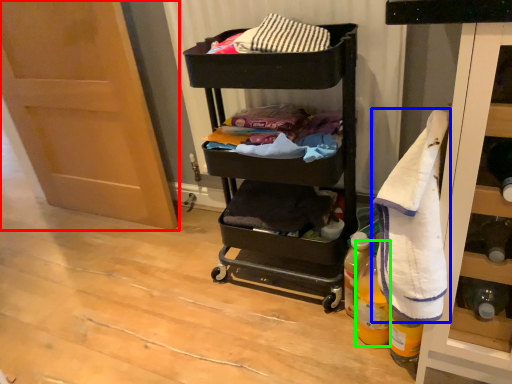
Question: Which object is positioned farthest from door (highlighted by a red box)? Select from bath towel (highlighted by a blue box) and bottle (highlighted by a green box).

Choices:
 (A) bath towel
 (B) bottle

Answer: (A)